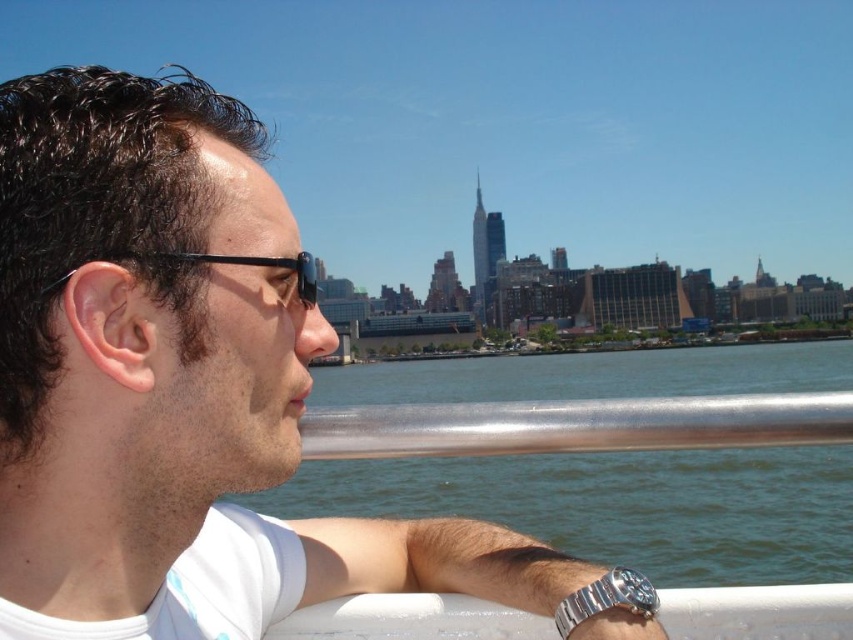
You are a photographer trying to capture the city skyline in the background. You notice the white matte shirt at center and the silver metallic rail at center in your shot. Which object should you adjust your camera angle to avoid blocking the skyline, and why?

You should adjust your camera angle to avoid the white matte shirt at center because it is taller than the silver metallic rail at center and would block the skyline more effectively.

You are a photographer aiming to capture the entire scene of the white matte shirt at center and the clear blue water at center in one shot. Given their sizes, which object will appear smaller in the final photograph?

The white matte shirt at center will appear smaller in the final photograph since it has a smaller size compared to the clear blue water at center.

Looking at this image, you are a photographer trying to capture the man in the white matte shirt at center and the clear blue water at center in a single shot. Given that your camera has a minimum focus distance of 100 meters, will you be able to focus on both subjects simultaneously?

The white matte shirt at center and clear blue water at center are 113.65 meters apart from each other. Since the distance between them is greater than the camera minimum focus distance of 100 meters, the camera can focus on both subjects simultaneously.